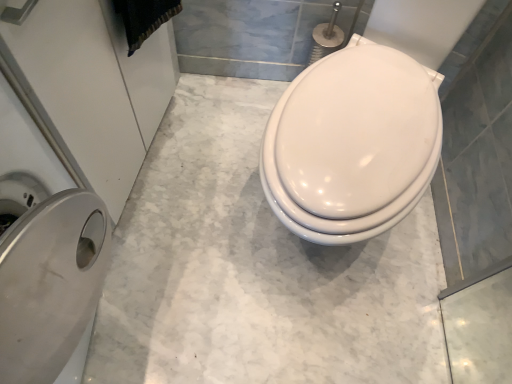
Question: Is point (138, 21) positioned closer to the camera than point (358, 46)?

Choices:
 (A) farther
 (B) closer

Answer: (B)

Question: From the image's perspective, relative to white glossy toilet at center, is black fabric at upper left above or below?

Choices:
 (A) above
 (B) below

Answer: (A)

Question: Estimate the real-world distances between objects in this image. Which object is closer to the white glossy toilet at center?

Choices:
 (A) silver metallic trash can at left
 (B) black fabric at upper left

Answer: (B)

Question: Which is farther from the white glossy toilet at center?

Choices:
 (A) silver metallic trash can at left
 (B) black fabric at upper left

Answer: (A)